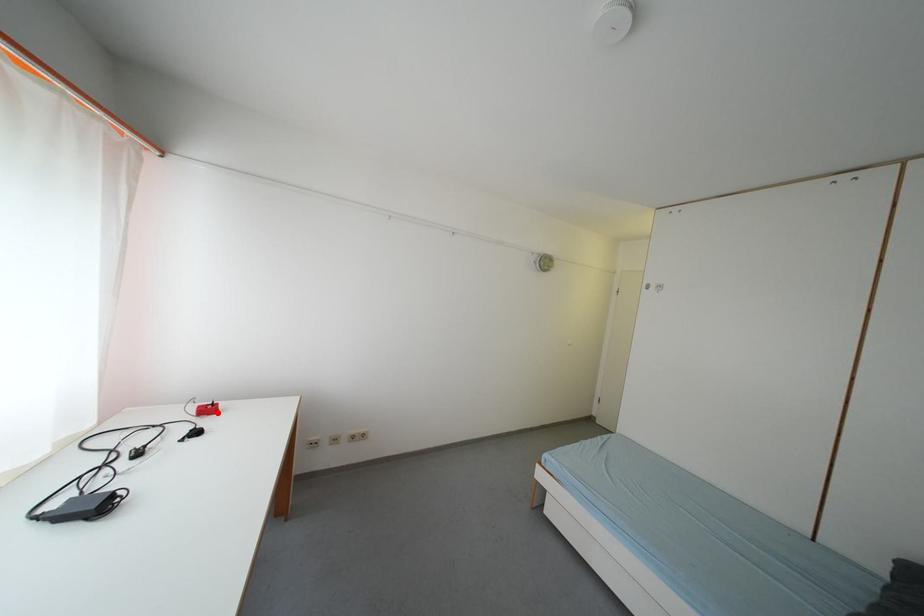
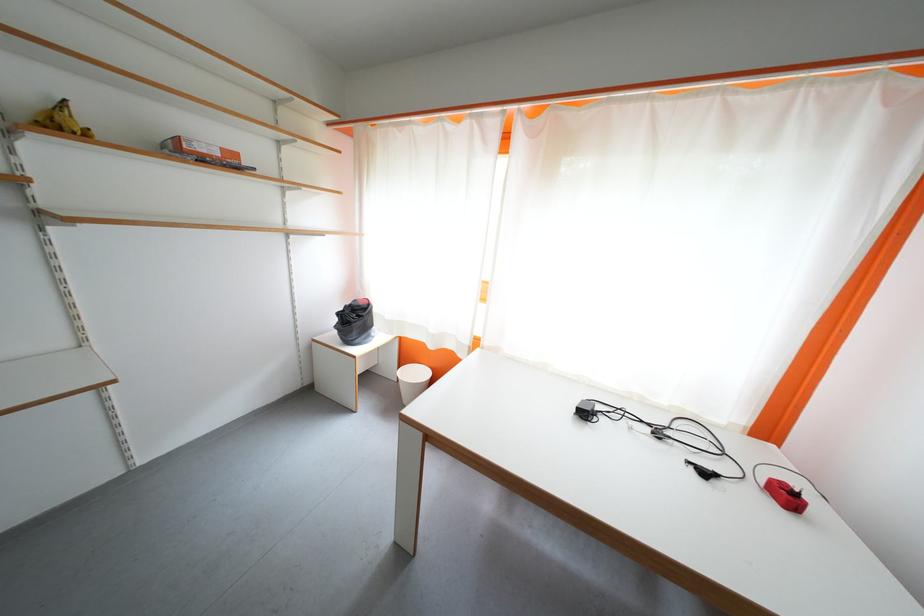
In the second image, find the point that corresponds to the highlighted location in the first image.

(796, 500)